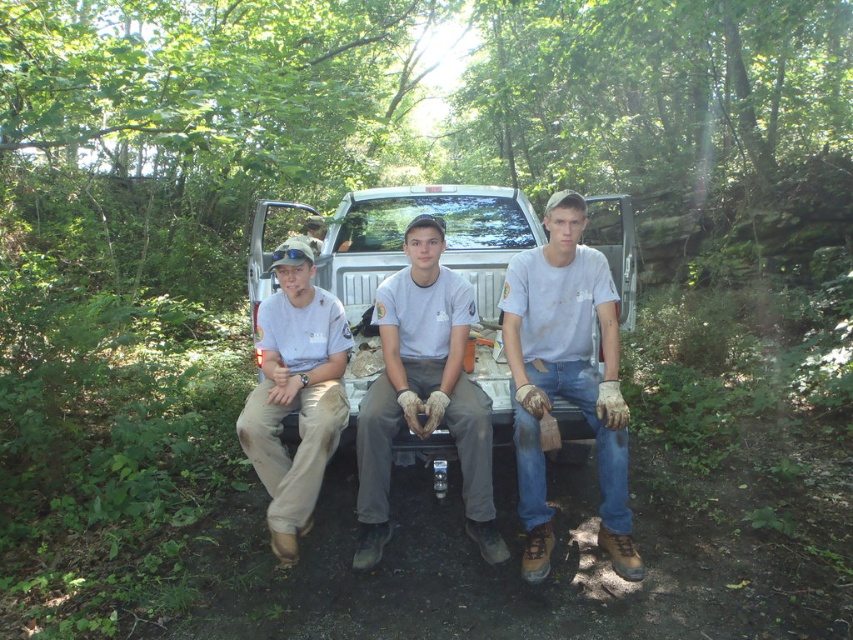
Is point (556, 266) closer to viewer compared to point (297, 484)?

That is False.

Who is higher up, worn denim jeans at center or tan fabric shirt at center?

Positioned higher is worn denim jeans at center.

Consider the image. Who is more forward, (602, 333) or (271, 468)?

Point (271, 468) is in front.

Locate an element on the screen. worn denim jeans at center is located at coordinates (566, 378).

Does gray cotton shirt at center have a greater height compared to tan fabric shirt at center?

Indeed, gray cotton shirt at center has a greater height compared to tan fabric shirt at center.

You are a GUI agent. You are given a task and a screenshot of the screen. Output one action in this format:
    pyautogui.click(x=<x>, y=<y>)
    Task: Click on the gray cotton shirt at center
    
    Given the screenshot: What is the action you would take?
    pyautogui.click(x=424, y=392)

Locate an element on the screen. gray cotton shirt at center is located at coordinates (424, 392).

This screenshot has width=853, height=640. Describe the element at coordinates (566, 378) in the screenshot. I see `worn denim jeans at center` at that location.

Does worn denim jeans at center have a greater width compared to gray cotton shirt at center?

Incorrect, worn denim jeans at center's width does not surpass gray cotton shirt at center's.

Locate an element on the screen. The width and height of the screenshot is (853, 640). worn denim jeans at center is located at coordinates (566, 378).